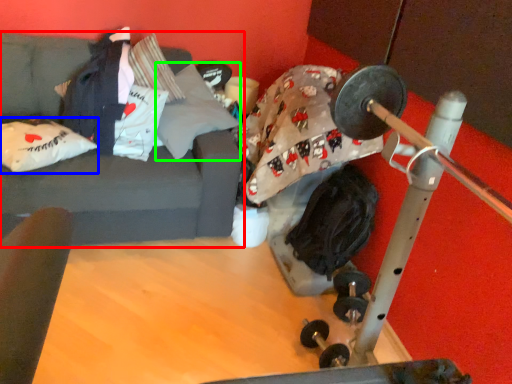
Question: Which is farther away from studio couch (highlighted by a red box)? pillow (highlighted by a blue box) or pillow (highlighted by a green box)?

Choices:
 (A) pillow
 (B) pillow

Answer: (B)